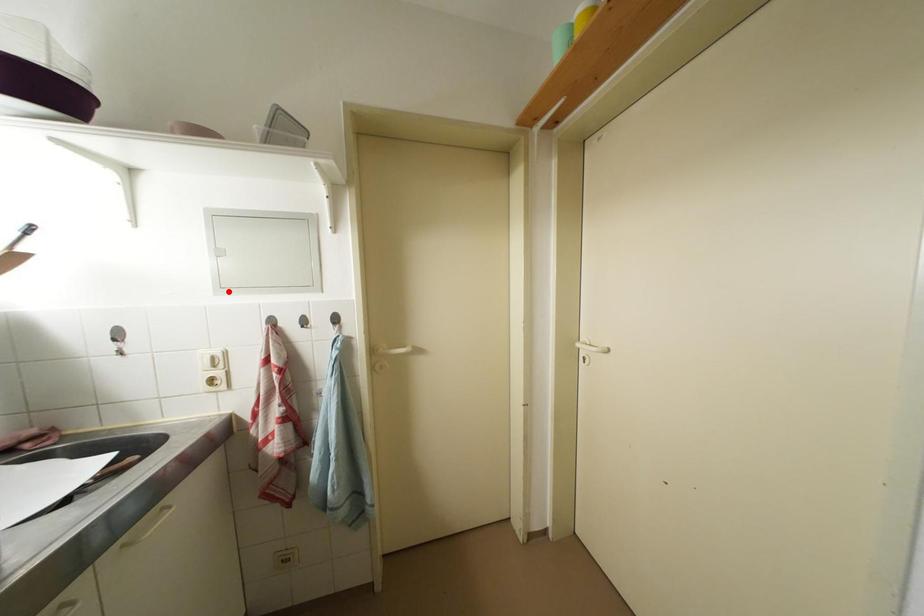
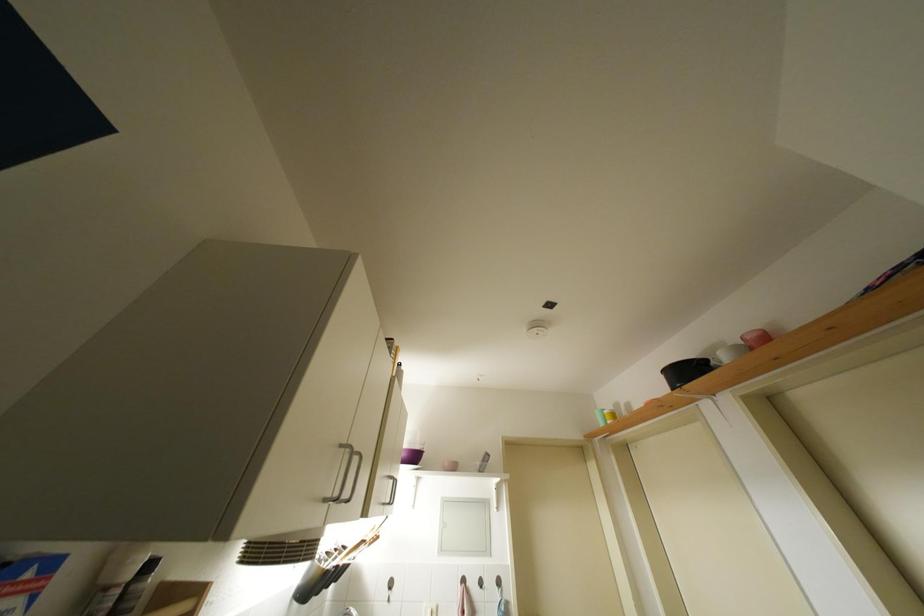
Question: I am providing you with two images of the same scene from different viewpoints. A red point is marked on the first image. Is the red point's position out of view in image 2?

Choices:
 (A) Yes
 (B) No

Answer: (B)